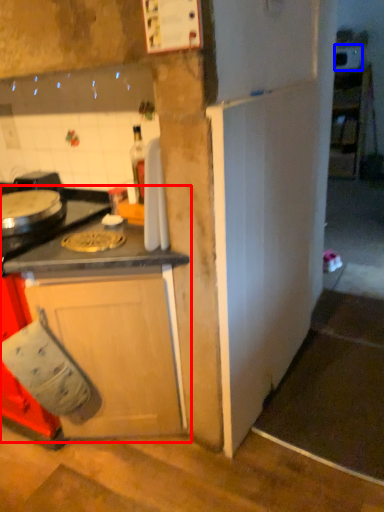
Question: Which object appears farthest to the camera in this image, cabinetry (highlighted by a red box) or appliance (highlighted by a blue box)?

Choices:
 (A) cabinetry
 (B) appliance

Answer: (B)